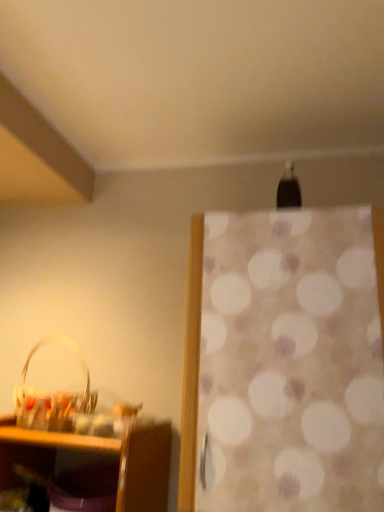
Question: Can you see white dotted fabric at center touching translucent plastic basket at lower left?

Choices:
 (A) yes
 (B) no

Answer: (B)

Question: Is white dotted fabric at center at the right side of translucent plastic basket at lower left?

Choices:
 (A) yes
 (B) no

Answer: (A)

Question: Does white dotted fabric at center turn towards translucent plastic basket at lower left?

Choices:
 (A) yes
 (B) no

Answer: (B)

Question: Is white dotted fabric at center bigger than translucent plastic basket at lower left?

Choices:
 (A) yes
 (B) no

Answer: (A)

Question: Is white dotted fabric at center far from translucent plastic basket at lower left?

Choices:
 (A) no
 (B) yes

Answer: (A)

Question: From a real-world perspective, is white dotted fabric at center located higher than translucent plastic basket at lower left?

Choices:
 (A) yes
 (B) no

Answer: (A)

Question: From a real-world perspective, is translucent plastic basket at lower left positioned over white dotted fabric at center based on gravity?

Choices:
 (A) no
 (B) yes

Answer: (A)

Question: Is translucent plastic basket at lower left oriented towards white dotted fabric at center?

Choices:
 (A) no
 (B) yes

Answer: (A)

Question: Is translucent plastic basket at lower left facing away from white dotted fabric at center?

Choices:
 (A) yes
 (B) no

Answer: (B)

Question: Is translucent plastic basket at lower left further to camera compared to white dotted fabric at center?

Choices:
 (A) no
 (B) yes

Answer: (B)

Question: Can you confirm if translucent plastic basket at lower left is taller than white dotted fabric at center?

Choices:
 (A) no
 (B) yes

Answer: (A)

Question: From the image's perspective, would you say translucent plastic basket at lower left is shown under white dotted fabric at center?

Choices:
 (A) no
 (B) yes

Answer: (B)

Question: Which is correct: white dotted fabric at center is inside translucent plastic basket at lower left, or outside of it?

Choices:
 (A) inside
 (B) outside

Answer: (B)